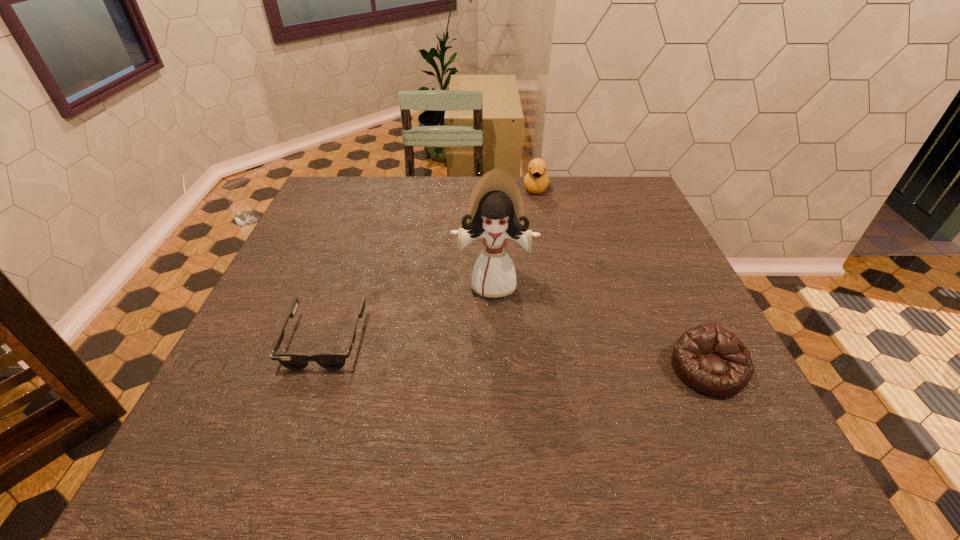
The image size is (960, 540). Identify the location of free space between the leftmost object and the third object from right to left. (409, 312).

Where is `unoccupied area between the third object from right to left and the rightmost object`? This screenshot has width=960, height=540. unoccupied area between the third object from right to left and the rightmost object is located at coordinates [601, 326].

Locate an element on the screen. This screenshot has height=540, width=960. free spot between the farthest object and the leftmost object is located at coordinates (430, 264).

Where is `free space that is in between the second shortest object and the duckling`? free space that is in between the second shortest object and the duckling is located at coordinates (622, 279).

Identify the location of vacant point located between the tallest object and the shortest object. (409, 312).

Find the location of a particular element. free space that is in between the third object from right to left and the sunglasses is located at coordinates (409, 312).

Locate which object is the third closest to the third object from right to left. Please provide its 2D coordinates. Your answer should be formatted as a tuple, i.e. [(x, y)], where the tuple contains the x and y coordinates of a point satisfying the conditions above.

[(536, 180)]

Select which object appears as the third closest to the beanbag. Please provide its 2D coordinates. Your answer should be formatted as a tuple, i.e. [(x, y)], where the tuple contains the x and y coordinates of a point satisfying the conditions above.

[(295, 361)]

Locate an element on the screen. The height and width of the screenshot is (540, 960). vacant space that satisfies the following two spatial constraints: 1. on the temples of the leftmost object; 2. on the right side of the rightmost object is located at coordinates (315, 369).

Locate an element on the screen. The width and height of the screenshot is (960, 540). free space that satisfies the following two spatial constraints: 1. on the temples of the sunglasses; 2. on the right side of the second shortest object is located at coordinates (315, 369).